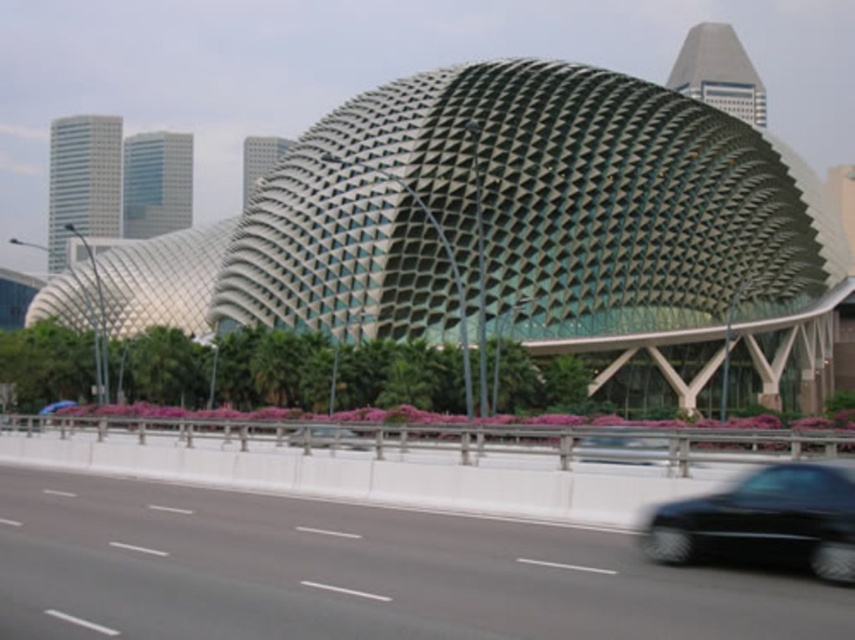
Question: Which is farther from the black metallic car at center?

Choices:
 (A) black glossy car at center
 (B) shiny black car at lower right

Answer: (A)

Question: Which point appears closest to the camera in this image?

Choices:
 (A) (673, 76)
 (B) (320, 444)
 (C) (594, 461)

Answer: (C)

Question: Does green metallic dome at center lie in front of black glossy car at center?

Choices:
 (A) no
 (B) yes

Answer: (A)

Question: Does gray asphalt highway at lower center lie in front of black glossy car at center?

Choices:
 (A) no
 (B) yes

Answer: (B)

Question: Can you confirm if gray asphalt highway at lower center is positioned to the left of black glossy car at center?

Choices:
 (A) no
 (B) yes

Answer: (B)

Question: Which of these objects is positioned closest to the gray asphalt highway at lower center?

Choices:
 (A) black metallic car at center
 (B) shiny black car at lower right
 (C) green metallic dome at center

Answer: (A)